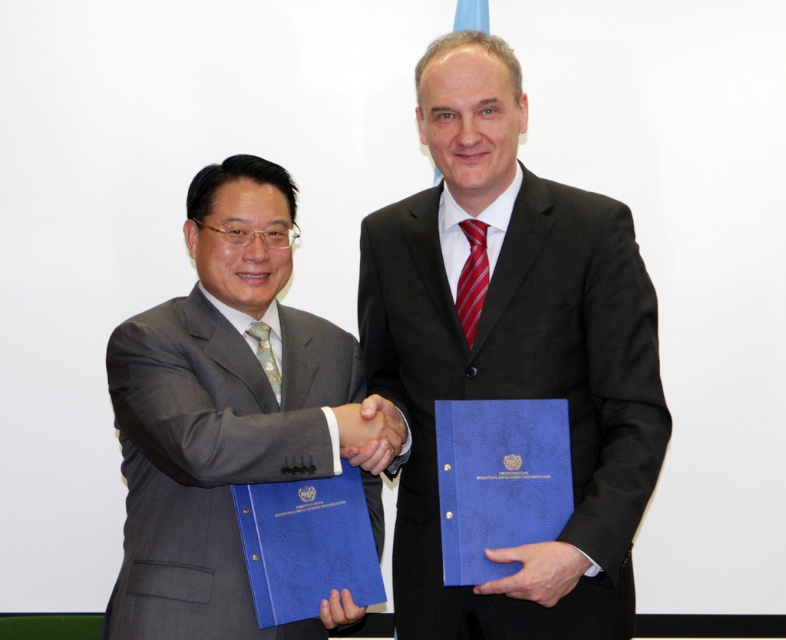
Looking at this image, you are a photographer adjusting the lighting for a professional photo shoot. You need to ensure that the black matte suit at center and the matte black hand at center are evenly lit. Given their distance apart, do you think the lighting setup will require adjustment to avoid shadows between them?

The black matte suit at center is 12.75 inches from matte black hand at center. Since the distance is relatively small, the lighting setup may not require major adjustments to ensure even illumination between them, but minor tweaks might be needed depending on the light source direction and intensity.

Based on the photo, you are an event planner organizing a formal business meeting. You need to seat the two individuals based on their attire. The black matte suit at center and the matte gray suit at left are present. Which individual should be seated first according to formal protocol, considering their clothing size?

The black matte suit at center is larger in size than the matte gray suit at left, so the individual wearing the black matte suit at center should be seated first as larger attire often signifies higher status in formal settings.